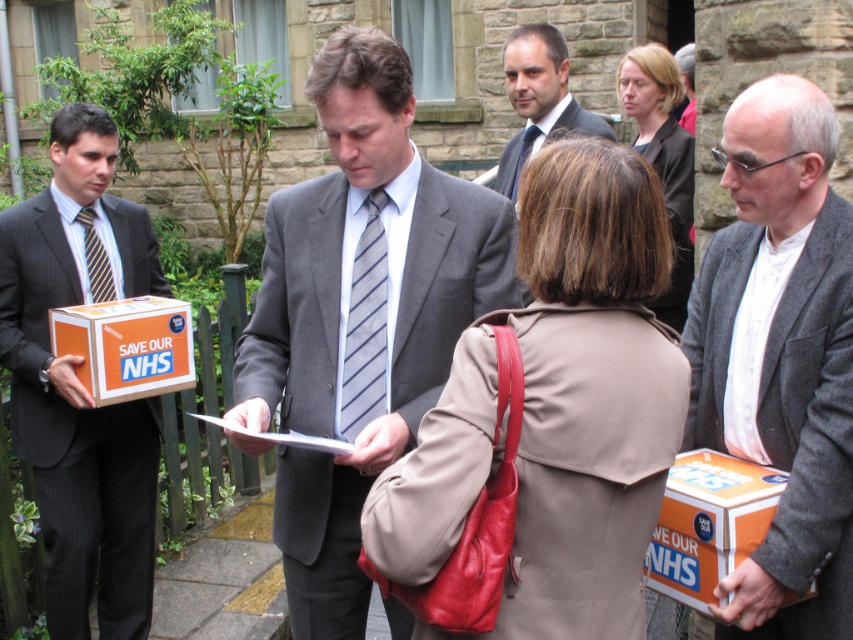
You are organizing a protest and need to place materials. You have an orange cardboard box at lower right and a matte gray tie at center. Which object can hold more campaign materials?

The orange cardboard box at lower right can hold more campaign materials since it has a larger size compared to the matte gray tie at center.

You are a photographer at the event and want to capture a photo that includes both the orange cardboard box at lower right and the matte gray tie at center. Which object should be positioned closer to the camera to ensure both are in focus?

The orange cardboard box at lower right is in front of the matte gray tie at center. To ensure both are in focus, position the orange cardboard box at lower right closer to the camera since it is already in front of the matte gray tie at center.

You are a photographer standing in the courtyard. You want to take a clear photo of the beige leather coat at center without any people blocking it. The coat is currently 5.29 feet away from you. Can you step back to get a better angle while keeping the coat in frame?

The beige leather coat at center is 5.29 feet away from the viewer. Stepping back might keep the coat in frame but could make it appear smaller. However, the question is about avoiding people blocking it, so moving sideways or adjusting position might be better than stepping back. The answer should focus on the distance given and whether stepping back would help with blocking people. Since the distance is 5.29 feet, stepping back might not resolve people in front unless they move. The answer should state it